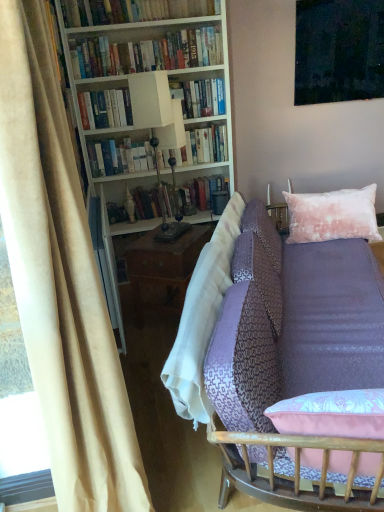
The width and height of the screenshot is (384, 512). Describe the element at coordinates (205, 146) in the screenshot. I see `hardcover books at center, which is the first book from bottom to top` at that location.

The width and height of the screenshot is (384, 512). Find the location of `beige velvet curtain at left`. beige velvet curtain at left is located at coordinates (61, 281).

Describe the element at coordinates (167, 204) in the screenshot. The image size is (384, 512). I see `metallic polished lamp at center` at that location.

This screenshot has height=512, width=384. In order to click on hardcover books at upper left, which is the 1th book in top-to-bottom order in this screenshot , I will do tap(133, 10).

Identify the location of hardcover books at center, which is the first book from bottom to top. 205,146.

Can you confirm if metallic polished lamp at center is positioned to the left of white matte bookcase at upper left?

No.

Is metallic polished lamp at center aimed at white matte bookcase at upper left?

No, metallic polished lamp at center does not turn towards white matte bookcase at upper left.

Can you confirm if metallic polished lamp at center is wider than white matte bookcase at upper left?

Incorrect, the width of metallic polished lamp at center does not surpass that of white matte bookcase at upper left.

Considering the relative positions of metallic polished lamp at center and white matte bookcase at upper left in the image provided, is metallic polished lamp at center behind white matte bookcase at upper left?

No.

In the scene shown: Considering the relative sizes of hardcover books at center, which is the first book from bottom to top, and lavender fabric couch at center in the image provided, is hardcover books at center, which is the first book from bottom to top, taller than lavender fabric couch at center?

No, hardcover books at center, which is the first book from bottom to top, is not taller than lavender fabric couch at center.

From the picture: Can you confirm if hardcover books at center, which is the first book from bottom to top, is bigger than lavender fabric couch at center?

No.

Based on the photo, which object is wider, hardcover books at center, which is the first book from bottom to top, or lavender fabric couch at center?

lavender fabric couch at center is wider.

How many degrees apart are the facing directions of hardcover books at center, which is the first book from bottom to top, and hardcover books at upper left, which is the 1th book in top-to-bottom order?

The angular difference between hardcover books at center, which is the first book from bottom to top, and hardcover books at upper left, which is the 1th book in top-to-bottom order, is 1.16 degrees.

From a real-world perspective, which is physically below, hardcover books at center, which is the 4th book in top-to-bottom order, or hardcover books at upper left, which ranks as the 4th book in bottom-to-top order?

hardcover books at center, which is the 4th book in top-to-bottom order, from a real-world perspective.

Is hardcover books at upper left, which is the 1th book in top-to-bottom order, at the back of hardcover books at center, which is the first book from bottom to top?

No.

Do you think hardcover books at center, which is the first book from bottom to top, is within hardcover books at upper left, which ranks as the 4th book in bottom-to-top order, or outside of it?

hardcover books at center, which is the first book from bottom to top, exists outside the volume of hardcover books at upper left, which ranks as the 4th book in bottom-to-top order.

Between hardcover books at center, which is the 4th book in top-to-bottom order, and metallic polished lamp at center, which one has larger size?

hardcover books at center, which is the 4th book in top-to-bottom order, is bigger.

How much distance is there between hardcover books at center, which is the first book from bottom to top, and metallic polished lamp at center?

hardcover books at center, which is the first book from bottom to top, and metallic polished lamp at center are 23.70 inches apart from each other.

From the picture: Which object is positioned more to the right, hardcover books at center, which is the 4th book in top-to-bottom order, or metallic polished lamp at center?

metallic polished lamp at center is more to the right.

From the image's perspective, which is below, velvet pink pillow at upper right or hardcover books at upper center, the 3th book when ordered from bottom to top?

velvet pink pillow at upper right, from the image's perspective.

Between velvet pink pillow at upper right and hardcover books at upper center, the 3th book when ordered from bottom to top, which one is positioned in front?

velvet pink pillow at upper right is more forward.

Between velvet pink pillow at upper right and hardcover books at upper center, the second book from the top, which one has smaller width?

Thinner between the two is hardcover books at upper center, the second book from the top.

Who is taller, velvet pink pillow at upper right or hardcover books at upper center, the second book from the top?

With more height is velvet pink pillow at upper right.

Does lavender fabric couch at center turn towards hardcover books at upper center, acting as the third book starting from the top?

No, lavender fabric couch at center is not turned towards hardcover books at upper center, acting as the third book starting from the top.

Is lavender fabric couch at center taller or shorter than hardcover books at upper center, marked as the second book in a bottom-to-top arrangement?

Considering their sizes, lavender fabric couch at center has more height than hardcover books at upper center, marked as the second book in a bottom-to-top arrangement.

Would you say lavender fabric couch at center contains hardcover books at upper center, marked as the second book in a bottom-to-top arrangement?

No, hardcover books at upper center, marked as the second book in a bottom-to-top arrangement, is not a part of lavender fabric couch at center.

Consider the image. Is hardcover books at upper center, the 3th book when ordered from bottom to top, bigger than hardcover books at center, which is the first book from bottom to top?

No, hardcover books at upper center, the 3th book when ordered from bottom to top, is not bigger than hardcover books at center, which is the first book from bottom to top.

Which of these two, hardcover books at upper center, the second book from the top, or hardcover books at center, which is the first book from bottom to top, stands taller?

Standing taller between the two is hardcover books at center, which is the first book from bottom to top.

Consider the image. Can you see hardcover books at upper center, the 3th book when ordered from bottom to top, touching hardcover books at center, which is the 4th book in top-to-bottom order?

No, hardcover books at upper center, the 3th book when ordered from bottom to top, is not touching hardcover books at center, which is the 4th book in top-to-bottom order.

Which is more distant, (119, 50) or (216, 143)?

Positioned behind is point (216, 143).

Locate an element on the screen. bookcase that appears above the metallic polished lamp at center (from the image's perspective) is located at coordinates (148, 108).

You are a GUI agent. You are given a task and a screenshot of the screen. Output one action in this format:
    pyautogui.click(x=<x>, y=<y>)
    Task: Click on the 1st book directly above the lavender fabric couch at center (from a real-world perspective)
    
    Given the screenshot: What is the action you would take?
    pyautogui.click(x=205, y=146)

Considering their positions, is hardcover books at upper center, the 3th book when ordered from bottom to top, positioned further to hardcover books at center, which is the first book from bottom to top, than lavender fabric couch at center?

Among the two, lavender fabric couch at center is located further to hardcover books at center, which is the first book from bottom to top.

Based on the photo, based on their spatial positions, is white matte bookcase at upper left or hardcover books at upper center, marked as the second book in a bottom-to-top arrangement, further from hardcover books at center, which is the 4th book in top-to-bottom order?

The object further to hardcover books at center, which is the 4th book in top-to-bottom order, is hardcover books at upper center, marked as the second book in a bottom-to-top arrangement.

When comparing their distances from velvet pink pillow at upper right, does hardcover books at center, which is the first book from bottom to top, or lavender fabric couch at center seem further?

Based on the image, hardcover books at center, which is the first book from bottom to top, appears to be further to velvet pink pillow at upper right.

From the image, which object appears to be nearer to hardcover books at upper center, the second book from the top, white matte bookcase at upper left or hardcover books at center, which is the first book from bottom to top?

white matte bookcase at upper left.

When comparing their distances from hardcover books at upper left, which ranks as the 4th book in bottom-to-top order, does velvet pink pillow at upper right or metallic polished lamp at center seem further?

Based on the image, velvet pink pillow at upper right appears to be further to hardcover books at upper left, which ranks as the 4th book in bottom-to-top order.

When comparing their distances from beige velvet curtain at left, does velvet pink pillow at upper right or hardcover books at upper left, which is the 1th book in top-to-bottom order, seem further?

hardcover books at upper left, which is the 1th book in top-to-bottom order, lies further to beige velvet curtain at left than the other object.

Considering their positions, is metallic polished lamp at center positioned closer to hardcover books at upper center, marked as the second book in a bottom-to-top arrangement, than hardcover books at center, which is the 4th book in top-to-bottom order?

hardcover books at center, which is the 4th book in top-to-bottom order, lies closer to hardcover books at upper center, marked as the second book in a bottom-to-top arrangement, than the other object.

From the picture: Considering their positions, is beige velvet curtain at left positioned closer to lavender fabric couch at center than hardcover books at upper center, acting as the third book starting from the top?

Based on the image, beige velvet curtain at left appears to be nearer to lavender fabric couch at center.

What are the coordinates of `book between lavender fabric couch at center and hardcover books at upper center, the second book from the top, from front to back` in the screenshot? It's located at (133, 10).

Where is `bookcase between lavender fabric couch at center and hardcover books at center, which is the first book from bottom to top, in the front-back direction`? The height and width of the screenshot is (512, 384). bookcase between lavender fabric couch at center and hardcover books at center, which is the first book from bottom to top, in the front-back direction is located at coordinates (148, 108).

The height and width of the screenshot is (512, 384). What are the coordinates of `studio couch between beige velvet curtain at left and velvet pink pillow at upper right along the z-axis` in the screenshot? It's located at (275, 345).

Where is `bookcase that lies between hardcover books at upper center, the second book from the top, and hardcover books at center, which is the 4th book in top-to-bottom order, from top to bottom`? bookcase that lies between hardcover books at upper center, the second book from the top, and hardcover books at center, which is the 4th book in top-to-bottom order, from top to bottom is located at coordinates (148, 108).